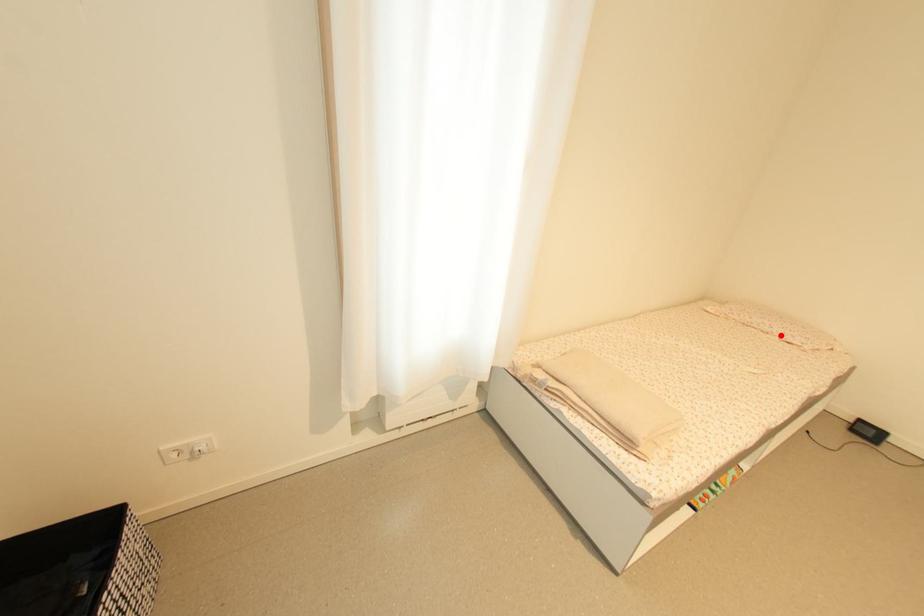
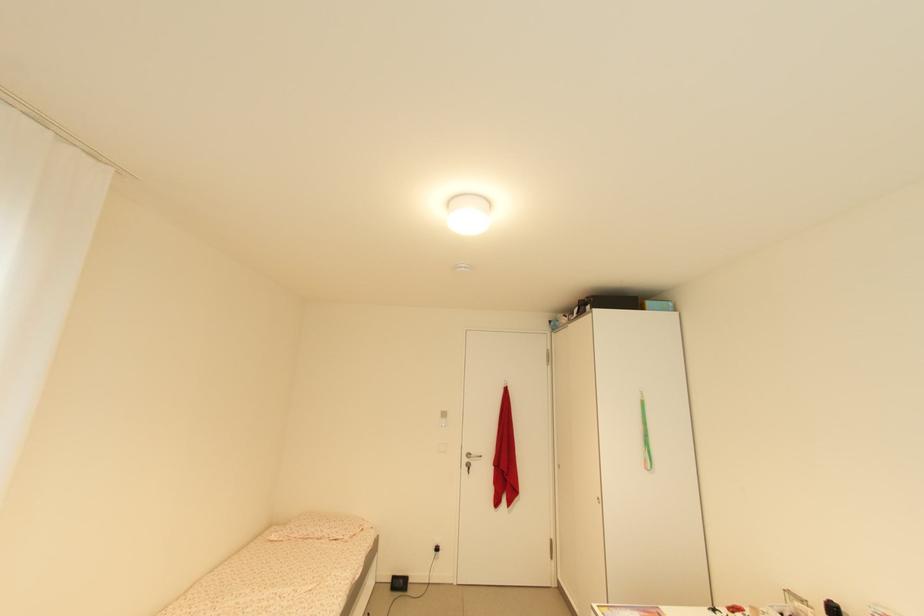
Find the pixel in the second image that matches the highlighted location in the first image.

(332, 538)